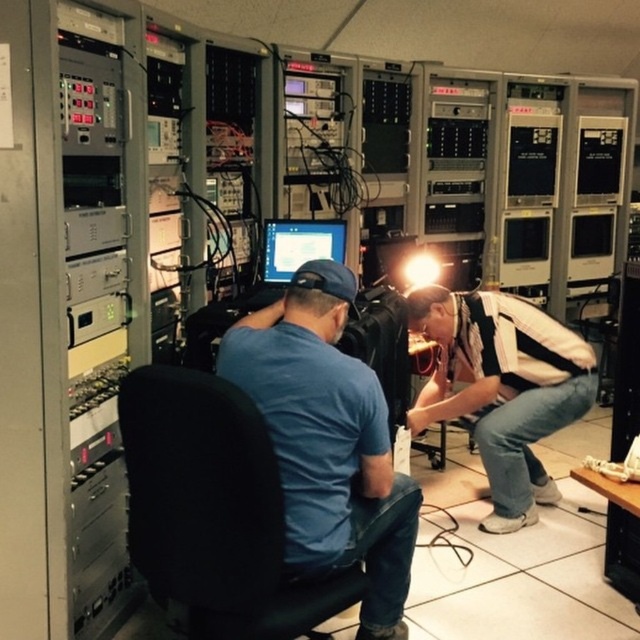
Is white striped shirt at lower right above matte black monitor at center?

Incorrect, white striped shirt at lower right is not positioned above matte black monitor at center.

Who is taller, white striped shirt at lower right or matte black monitor at center?

With more height is white striped shirt at lower right.

Identify the location of white striped shirt at lower right. (502, 388).

Does point (250, 547) come closer to viewer compared to point (570, 404)?

Yes.

Between point (173, 620) and point (484, 458), which one is positioned behind?

Point (484, 458)

Find the location of a particular element. The image size is (640, 640). black fabric swivel chair at center is located at coordinates (212, 512).

Which is behind, point (132, 502) or point (328, 513)?

Positioned behind is point (328, 513).

Is black fabric swivel chair at center positioned before blue cotton shirt at center?

That is True.

Does point (193, 461) come behind point (385, 449)?

No, it is in front of (385, 449).

Where is `black fabric swivel chair at center`? black fabric swivel chair at center is located at coordinates (212, 512).